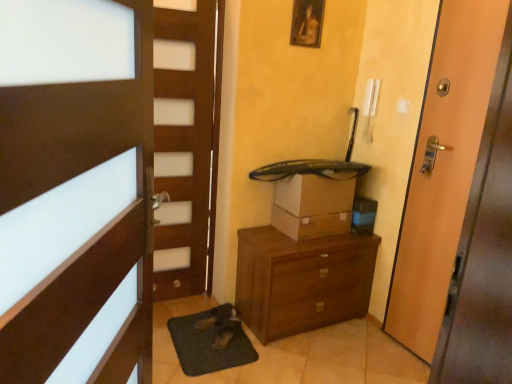
Question: Is brown cardboard box at center spatially inside wooden picture frame at upper center, or outside of it?

Choices:
 (A) inside
 (B) outside

Answer: (B)

Question: In terms of size, does brown cardboard box at center appear bigger or smaller than wooden picture frame at upper center?

Choices:
 (A) small
 (B) big

Answer: (B)

Question: Estimate the real-world distances between objects in this image. Which object is closer to the brown wooden chest of drawers at center?

Choices:
 (A) brown wooden door at left, which is the first door in front-to-back order
 (B) brown cardboard box at center
 (C) wooden picture frame at upper center
 (D) green rubber bath mat at lower center
 (E) wooden door at right, which is counted as the 2th door, starting from the left

Answer: (B)

Question: Which object is positioned farthest from the brown cardboard box at center?

Choices:
 (A) wooden picture frame at upper center
 (B) brown wooden chest of drawers at center
 (C) wooden door at right, the 1th door when ordered from right to left
 (D) brown wooden door at left, which is the first door in front-to-back order
 (E) green rubber bath mat at lower center

Answer: (D)